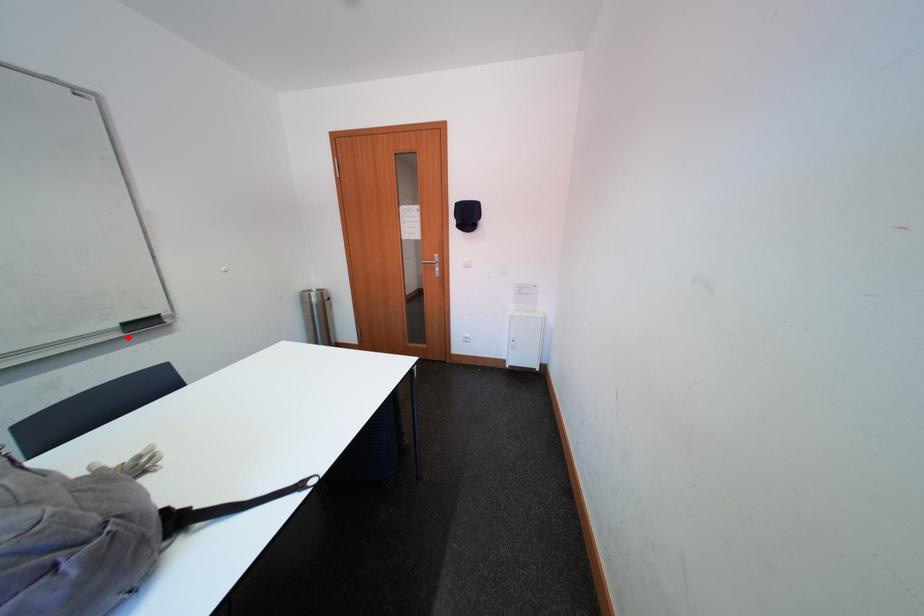
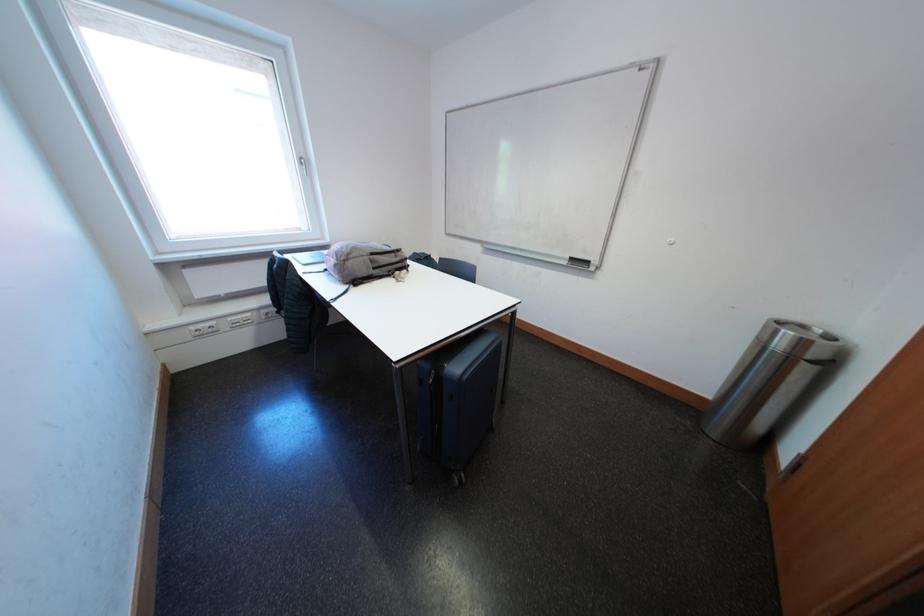
Question: I am providing you with two images of the same scene from different viewpoints. In image1, a red point is highlighted. Considering the same 3D point in image2, which of the following is correct?

Choices:
 (A) It is closer
 (B) It is farther

Answer: (A)